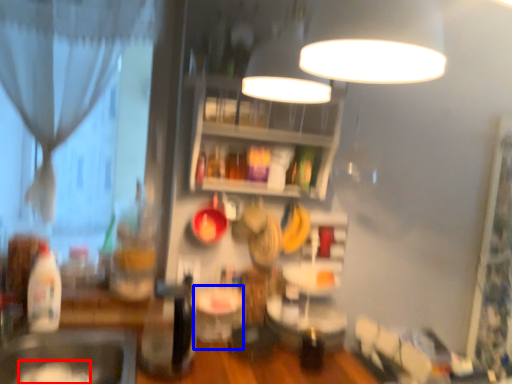
Question: Among these objects, which one is nearest to the camera, food (highlighted by a red box) or table (highlighted by a blue box)?

Choices:
 (A) food
 (B) table

Answer: (A)